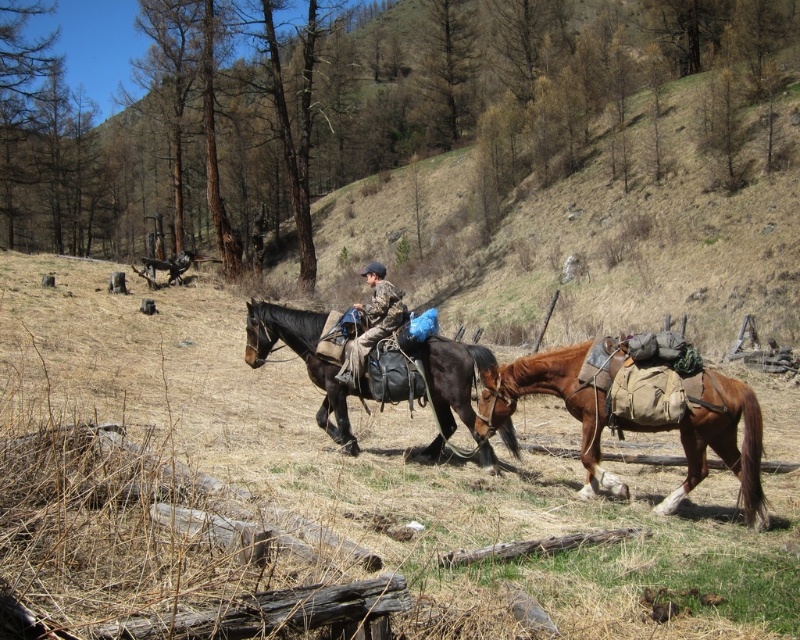
Who is lower down, brown leather horse at right or brown leather saddle at center?

brown leather horse at right

Does brown leather horse at right have a smaller size compared to brown leather saddle at center?

Yes.

The width and height of the screenshot is (800, 640). What are the coordinates of `brown leather horse at right` in the screenshot? It's located at (636, 420).

Is brown leather horse at right thinner than camouflage fabric jacket at center?

No.

Which is in front, point (600, 349) or point (382, 321)?

Point (600, 349) is in front.

You are a GUI agent. You are given a task and a screenshot of the screen. Output one action in this format:
    pyautogui.click(x=<x>, y=<y>)
    Task: Click on the brown leather horse at right
    This screenshot has height=640, width=800.
    Given the screenshot: What is the action you would take?
    pyautogui.click(x=636, y=420)

Can you confirm if brown leather saddle at center is positioned to the right of camouflage fabric jacket at center?

Yes, brown leather saddle at center is to the right of camouflage fabric jacket at center.

Does brown leather saddle at center appear on the left side of camouflage fabric jacket at center?

In fact, brown leather saddle at center is to the right of camouflage fabric jacket at center.

Locate an element on the screen. brown leather saddle at center is located at coordinates pyautogui.click(x=304, y=360).